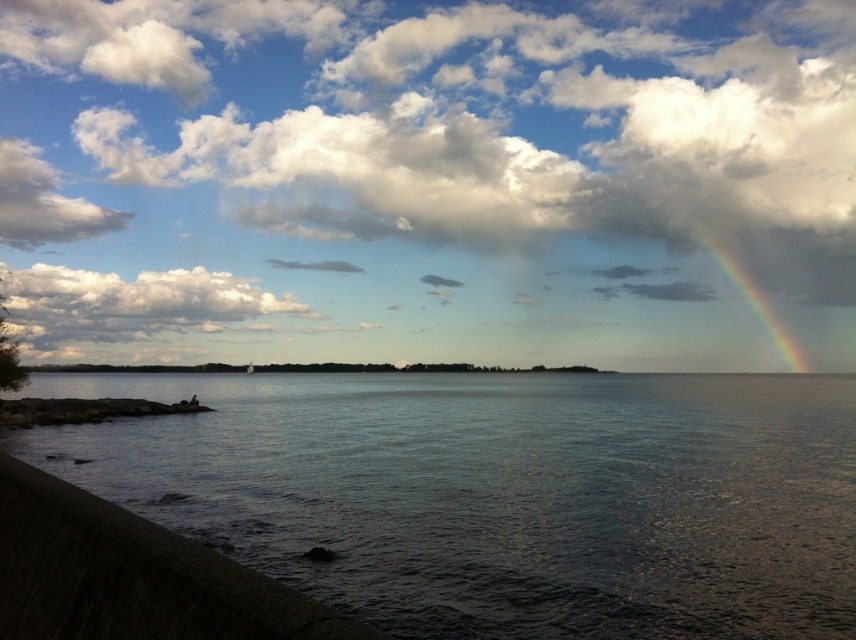
Does white fluffy cloud at upper center appear under rainbow at upper right?

No, white fluffy cloud at upper center is not below rainbow at upper right.

From the picture: Does white fluffy cloud at upper center appear over rainbow at upper right?

Correct, white fluffy cloud at upper center is located above rainbow at upper right.

Describe the element at coordinates (431, 180) in the screenshot. I see `white fluffy cloud at upper center` at that location.

Find the location of a particular element. white fluffy cloud at upper center is located at coordinates (431, 180).

Between white fluffy cloud at upper left and rainbow at upper right, which one has more height?

rainbow at upper right is taller.

Can you confirm if white fluffy cloud at upper left is shorter than rainbow at upper right?

Yes, white fluffy cloud at upper left is shorter than rainbow at upper right.

Identify the location of white fluffy cloud at upper left. (129, 305).

Locate an element on the screen. This screenshot has width=856, height=640. white fluffy cloud at upper left is located at coordinates (129, 305).

Can you confirm if dark gray water at lower left is positioned to the left of rainbow at upper right?

Indeed, dark gray water at lower left is positioned on the left side of rainbow at upper right.

Identify the location of dark gray water at lower left. (501, 493).

Find the location of a particular element. The width and height of the screenshot is (856, 640). dark gray water at lower left is located at coordinates (501, 493).